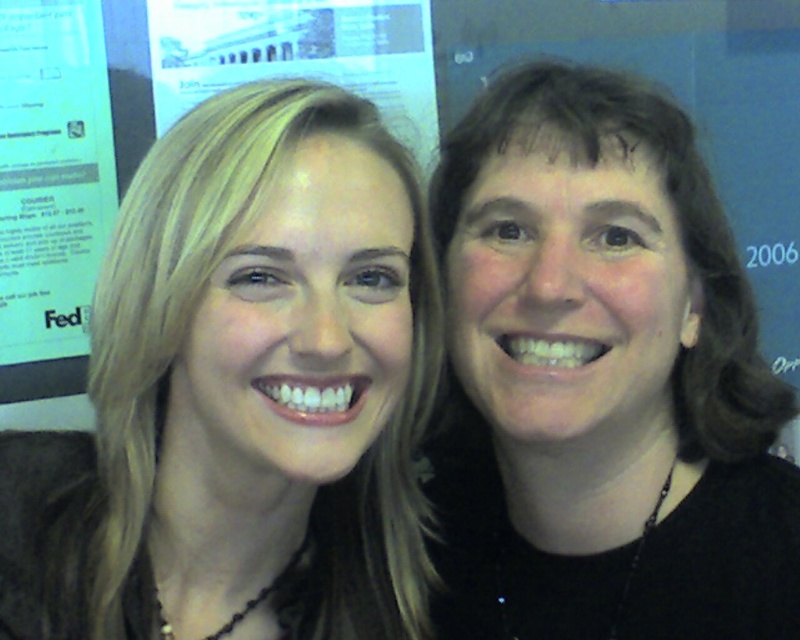
Question: Which point is farther to the camera?

Choices:
 (A) white paper at upper center
 (B) black matte shirt at right
 (C) white paper at left

Answer: (A)

Question: Which point is farther to the camera?

Choices:
 (A) black matte shirt at right
 (B) white paper at upper center
 (C) blonde hair at left
 (D) white paper at left

Answer: (B)

Question: Which point appears closest to the camera in this image?

Choices:
 (A) (424, 10)
 (B) (32, 508)
 (C) (22, 182)
 (D) (494, 321)

Answer: (B)

Question: Is blonde hair at left thinner than white paper at upper center?

Choices:
 (A) no
 (B) yes

Answer: (B)

Question: Observing the image, what is the correct spatial positioning of blonde hair at left in reference to black matte shirt at right?

Choices:
 (A) above
 (B) below

Answer: (B)

Question: Is blonde hair at left positioned at the back of white paper at upper center?

Choices:
 (A) yes
 (B) no

Answer: (B)